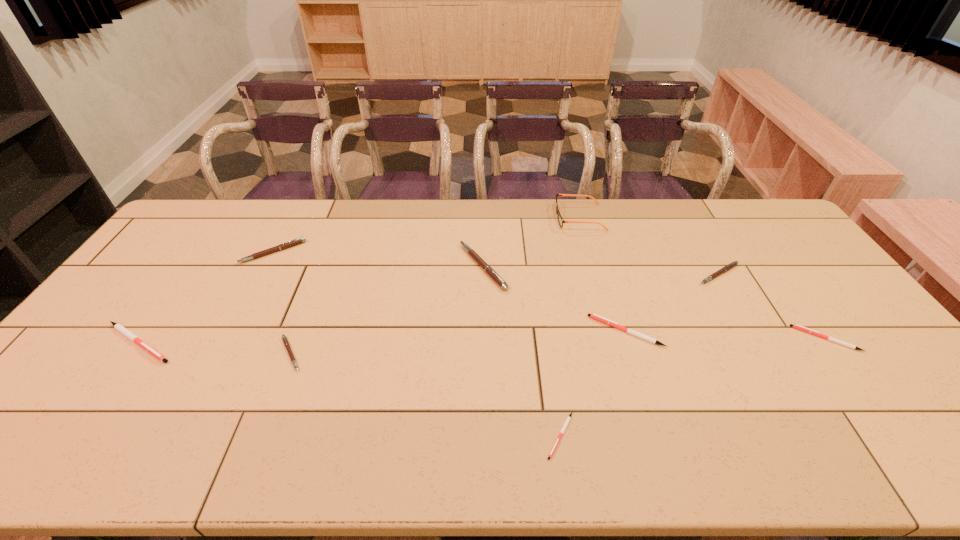
You are a GUI agent. You are given a task and a screenshot of the screen. Output one action in this format:
    pyautogui.click(x=<x>, y=<y>)
    Task: Click on the vacant space that satisfies the following two spatial constraints: 1. at the nib of the rightmost pink pen; 2. at the nib of the seventh object from right to left
    
    Given the screenshot: What is the action you would take?
    pyautogui.click(x=765, y=354)

At what (x,y) coordinates should I click in order to perform the action: click on free space that satisfies the following two spatial constraints: 1. at the nib of the seventh pen from left to right; 2. on the clicker of the third smallest white pen. Please return your answer as a coordinate pair (x, y). This screenshot has height=540, width=960. Looking at the image, I should click on [x=752, y=331].

The height and width of the screenshot is (540, 960). In order to click on blank area in the image that satisfies the following two spatial constraints: 1. on the front-facing side of the farthest object; 2. at the nib of the leftmost pink pen in this screenshot , I will do 589,252.

This screenshot has height=540, width=960. Find the location of `vacant space that satisfies the following two spatial constraints: 1. at the nib of the eighth object from left to right; 2. on the clicker of the biggest white pen`. vacant space that satisfies the following two spatial constraints: 1. at the nib of the eighth object from left to right; 2. on the clicker of the biggest white pen is located at coordinates (758, 342).